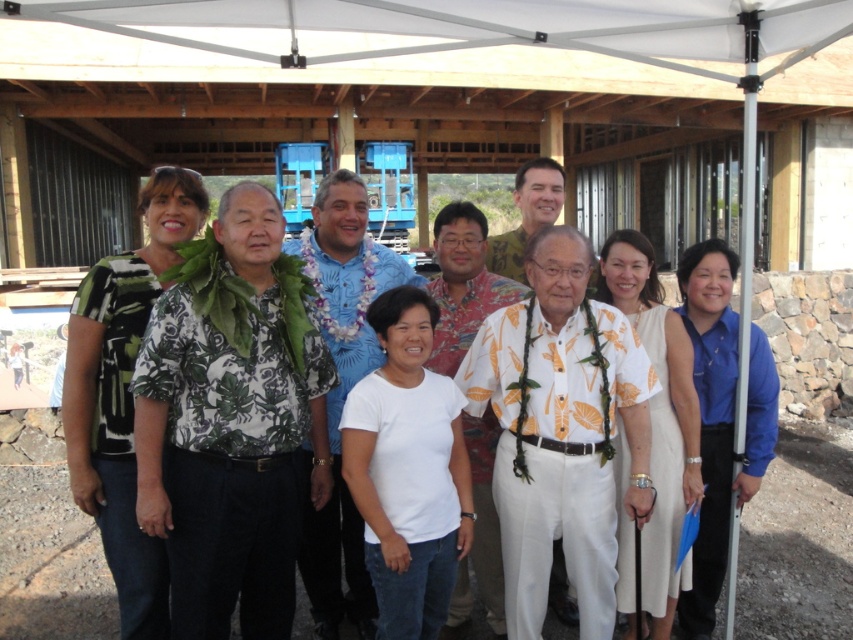
Question: Can you confirm if white cotton shirt at center is positioned below blue floral shirt at center?

Choices:
 (A) no
 (B) yes

Answer: (B)

Question: Is white cotton shirt at center bigger than blue floral shirt at center?

Choices:
 (A) no
 (B) yes

Answer: (B)

Question: Is white cotton shirt at center bigger than blue floral shirt at center?

Choices:
 (A) yes
 (B) no

Answer: (A)

Question: Among these objects, which one is nearest to the camera?

Choices:
 (A) blue floral shirt at center
 (B) white cotton shirt at center

Answer: (B)